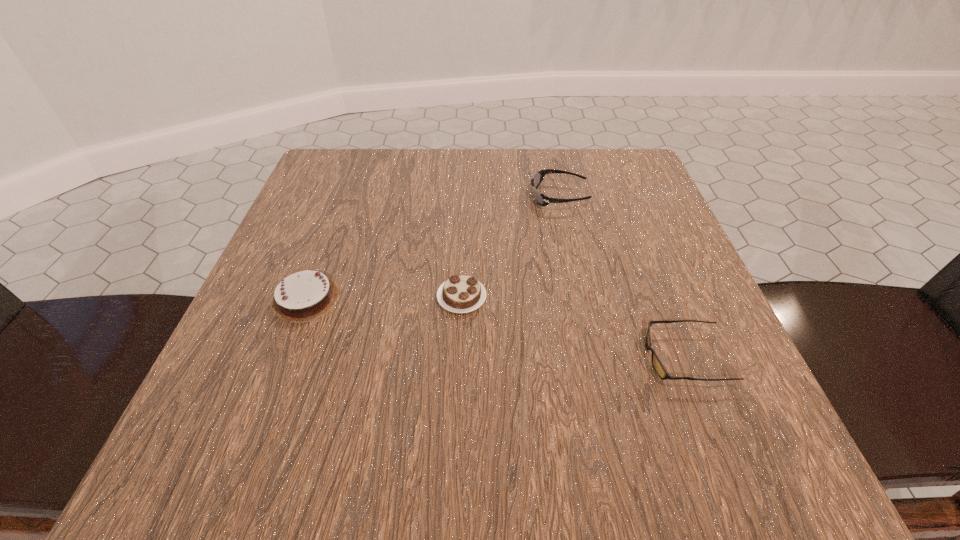
Find the location of a particular element. The height and width of the screenshot is (540, 960). vacant space at the right edge of the desktop is located at coordinates (644, 317).

This screenshot has height=540, width=960. Find the location of `free space at the far left corner`. free space at the far left corner is located at coordinates (306, 192).

Find the location of `free region at the far right corner of the desktop`. free region at the far right corner of the desktop is located at coordinates (637, 202).

You are a GUI agent. You are given a task and a screenshot of the screen. Output one action in this format:
    pyautogui.click(x=<x>, y=<y>)
    Task: Click on the vacant space at the near right corner
    
    Given the screenshot: What is the action you would take?
    [654, 451]

Find the location of `vacant area that lies between the farther sunglasses and the rightmost object`. vacant area that lies between the farther sunglasses and the rightmost object is located at coordinates (622, 277).

Image resolution: width=960 pixels, height=540 pixels. What are the coordinates of `blank region between the leftmost object and the rightmost object` in the screenshot? It's located at (495, 328).

At what (x,y) coordinates should I click in order to perform the action: click on free space that is in between the second object from left to right and the left chocolate cake. Please return your answer as a coordinate pair (x, y). The image size is (960, 540). Looking at the image, I should click on (384, 298).

The height and width of the screenshot is (540, 960). I want to click on free spot between the second object from left to right and the nearest object, so click(x=573, y=327).

Find the location of a particular element. vacant region between the right sunglasses and the farthest object is located at coordinates (622, 277).

This screenshot has height=540, width=960. Find the location of `free space between the nearer sunglasses and the leftmost object`. free space between the nearer sunglasses and the leftmost object is located at coordinates (495, 328).